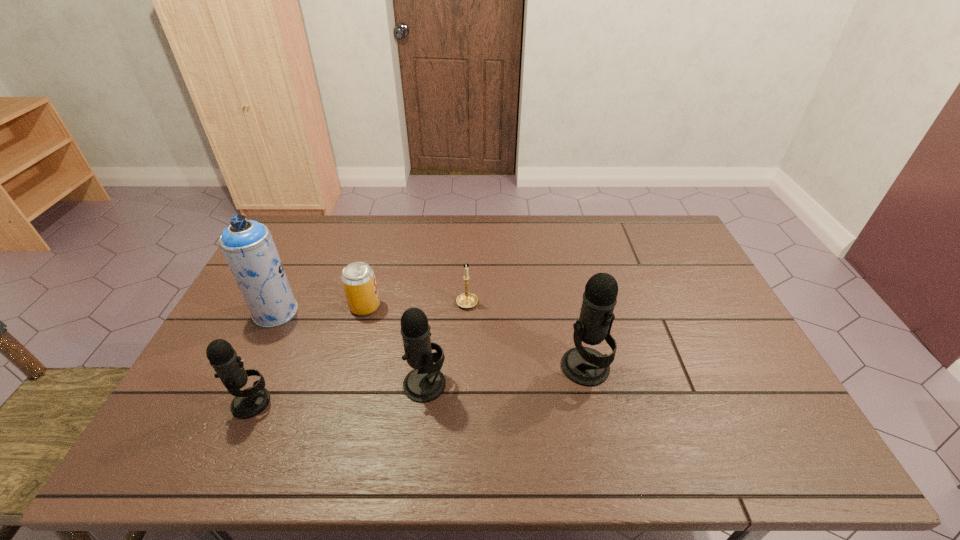
Identify which object is located as the fourth nearest to the rightmost microphone. Please provide its 2D coordinates. Your answer should be formatted as a tuple, i.e. [(x, y)], where the tuple contains the x and y coordinates of a point satisfying the conditions above.

[(249, 402)]

Find the location of a particular element. This screenshot has width=960, height=540. object that stands as the third closest to the fourth tallest object is located at coordinates (425, 383).

Point out which microphone is positioned as the nearest to the rightmost microphone. Please provide its 2D coordinates. Your answer should be formatted as a tuple, i.e. [(x, y)], where the tuple contains the x and y coordinates of a point satisfying the conditions above.

[(425, 383)]

Select which microphone is the third closest to the fifth object from left to right. Please provide its 2D coordinates. Your answer should be formatted as a tuple, i.e. [(x, y)], where the tuple contains the x and y coordinates of a point satisfying the conditions above.

[(249, 402)]

I want to click on vacant position in the image that satisfies the following two spatial constraints: 1. on the front side of the aerosol can; 2. on the left side of the rightmost microphone, so click(249, 367).

Locate an element on the screen. This screenshot has height=540, width=960. free space that satisfies the following two spatial constraints: 1. on the front side of the aerosol can; 2. on the left side of the shortest microphone is located at coordinates 231,402.